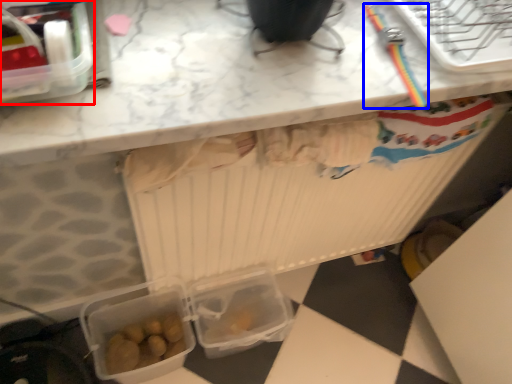
Question: Which of the following is the farthest to the observer, lunch box (highlighted by a red box) or tool (highlighted by a blue box)?

Choices:
 (A) lunch box
 (B) tool

Answer: (B)